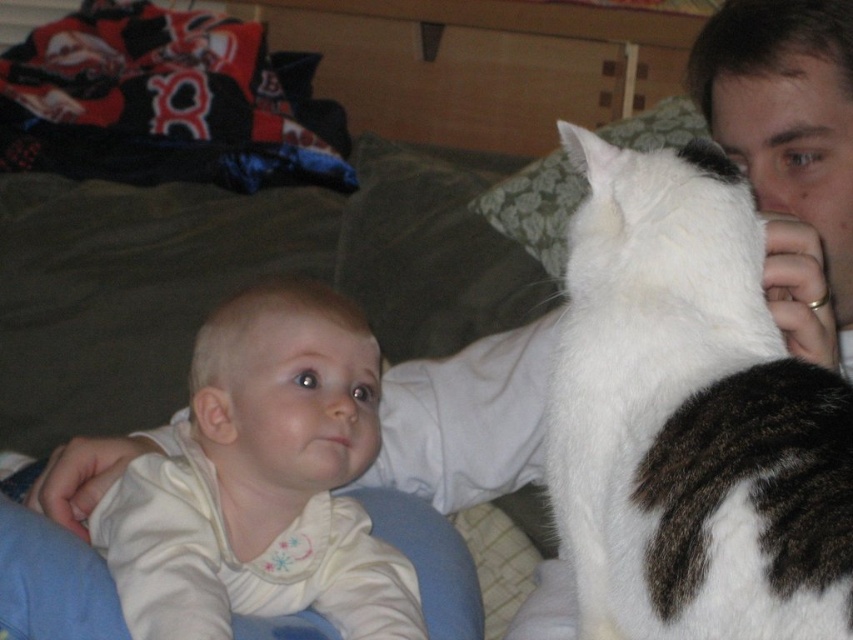
You are standing in the room and see two points marked in the image. Which point is closer to you, point (x=646, y=365) or point (x=317, y=547)?

Point (x=646, y=365) is in front of point (x=317, y=547), so it is closer to you.

You are a photographer trying to capture a closeup of the white soft fur cat at upper right and the white soft baby at center. Since the cat is smaller, which one should you zoom in on more to make them appear the same size in the photo?

The white soft fur cat at upper right is smaller than the white soft baby at center, so you should zoom in more on the cat to make them appear the same size in the photo.

You are a photographer trying to capture a photo of the white soft fur cat at upper right and the white soft baby at center. Since both are white, you want to ensure they are clearly visible in the photo. Based on their positions, which one is higher up in the frame?

The white soft fur cat at upper right is above the white soft baby at center, so it is higher up in the frame.